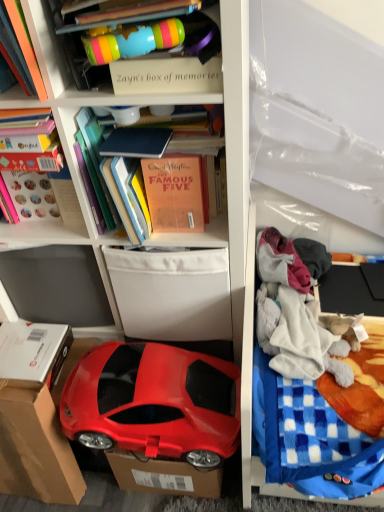
Question: Considering the positions of point (218, 443) and point (142, 182), is point (218, 443) closer or farther from the camera than point (142, 182)?

Choices:
 (A) farther
 (B) closer

Answer: (A)

Question: From a real-world perspective, is shiny red car at lower left above or below orange matte book at upper center, acting as the first book starting from the right?

Choices:
 (A) below
 (B) above

Answer: (A)

Question: Estimate the real-world distances between objects in this image. Which object is farther from the hardcover book at upper left, the third book in the right-to-left sequence?

Choices:
 (A) blue checkered blanket at right
 (B) matte plastic cup at upper center
 (C) white fabric storage box at center
 (D) fluffy cotton blanket at right, which is the 2th clothing in top-to-bottom order
 (E) cardboard at lower left

Answer: (A)

Question: Which is farther from the gray fleece blanket at right, the first clothing when ordered from top to bottom?

Choices:
 (A) white fabric storage box at center
 (B) blue checkered blanket at right
 (C) matte plastic toy car at lower left
 (D) cardboard at lower left
 (E) orange matte book at upper center, which is the third book in left-to-right order

Answer: (D)